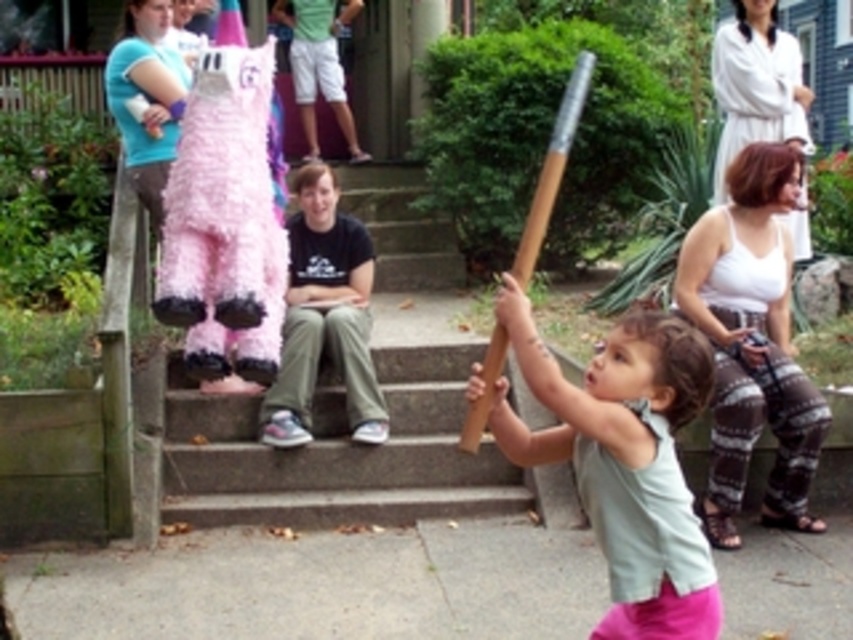
You are a fashion designer observing a child wearing two tops. You see the light green fabric shirt at center and the white cotton tank top at upper right. Which top is shorter in length?

The light green fabric shirt at center is shorter than the white cotton tank top at upper right.

You are a photographer trying to capture a clear shot of the white cotton tank top at upper right and the brown wooden bat at center. Which object should you focus on first to ensure it appears sharp in your photo?

You should focus on the white cotton tank top at upper right first because it is closer to you than the brown wooden bat at center, so it requires immediate focus to ensure sharpness.

You are a photographer trying to capture a photo of the brown wooden bat at center and the white cotton tank top at upper right. Based on their positions, which object should you focus on first to ensure both are in the frame?

The white cotton tank top at upper right is to the right of the brown wooden bat at center, so you should focus on the brown wooden bat at center first to ensure both are in the frame.